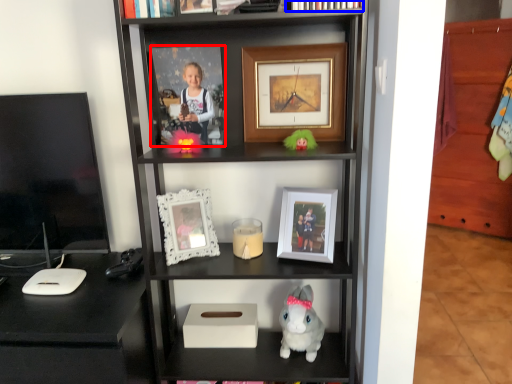
Question: Which point is further to the camera, picture frame (highlighted by a red box) or book (highlighted by a blue box)?

Choices:
 (A) picture frame
 (B) book

Answer: (A)